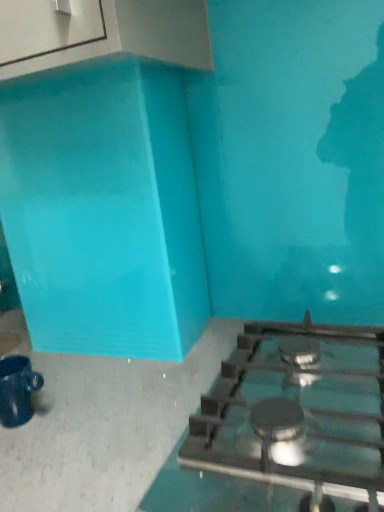
Question: Is satin silver gas stove at lower right in front of or behind matte black mug at lower left in the image?

Choices:
 (A) behind
 (B) front

Answer: (B)

Question: From a real-world perspective, relative to matte black mug at lower left, is satin silver gas stove at lower right vertically above or below?

Choices:
 (A) above
 (B) below

Answer: (B)

Question: From the image's perspective, relative to matte black mug at lower left, is satin silver gas stove at lower right above or below?

Choices:
 (A) above
 (B) below

Answer: (A)

Question: Is matte black mug at lower left inside the boundaries of satin silver gas stove at lower right, or outside?

Choices:
 (A) outside
 (B) inside

Answer: (A)

Question: Looking at the image, does matte black mug at lower left seem bigger or smaller compared to satin silver gas stove at lower right?

Choices:
 (A) small
 (B) big

Answer: (A)

Question: From a real-world perspective, is matte black mug at lower left positioned above or below satin silver gas stove at lower right?

Choices:
 (A) above
 (B) below

Answer: (A)

Question: From their relative heights in the image, would you say matte black mug at lower left is taller or shorter than satin silver gas stove at lower right?

Choices:
 (A) short
 (B) tall

Answer: (B)